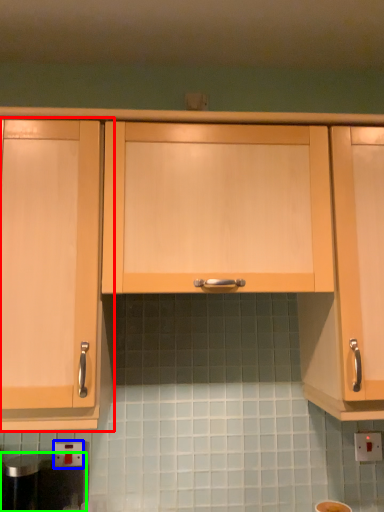
Question: Which object is positioned farthest from cabinetry (highlighted by a red box)? Select from electric outlet (highlighted by a blue box) and appliance (highlighted by a green box).

Choices:
 (A) electric outlet
 (B) appliance

Answer: (A)